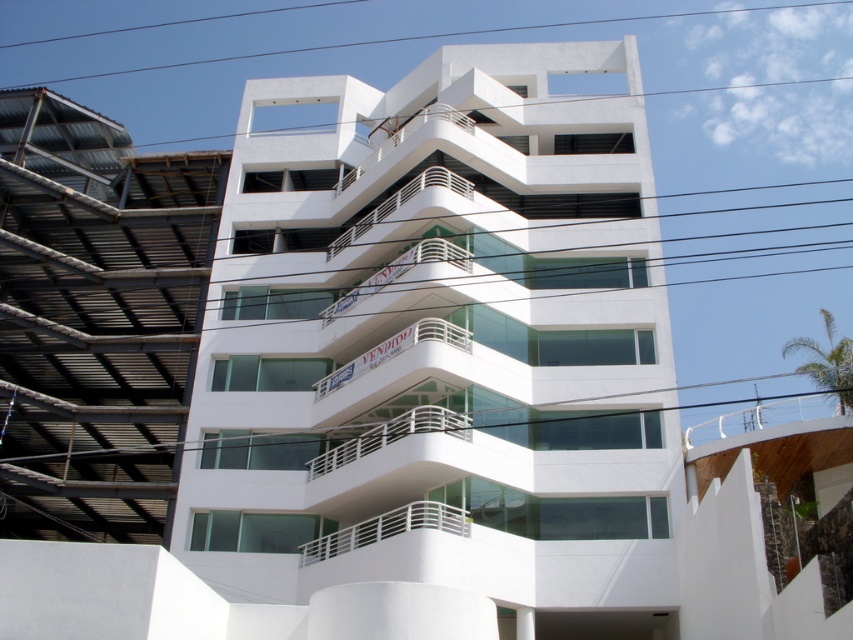
You are an architect evaluating the building facade. You notice the white glass balcony at center and the white metal railing at center. Which one has a greater width?

The white glass balcony at center has a greater width than the white metal railing at center, as stated in the description.

Consider the image. You are an architect evaluating the building facade. You notice the white glass balcony at center and the white metal railing at center. Which of these two elements has a greater height measurement?

The white glass balcony at center is much taller than the white metal railing at center according to the description provided.

You are standing at the entrance of the modern building and want to locate the white glass balcony at center. According to the building floor plan, which coordinate point should you look for?

The white glass balcony at center is located at coordinate point (439, 339).